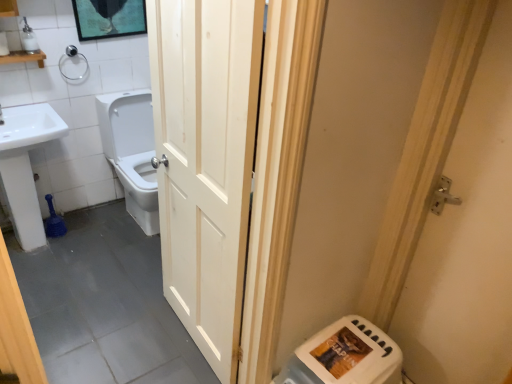
Where is `free point to the left of white wood door at center, the 2th door in the right-to-left sequence`? free point to the left of white wood door at center, the 2th door in the right-to-left sequence is located at coordinates (130, 325).